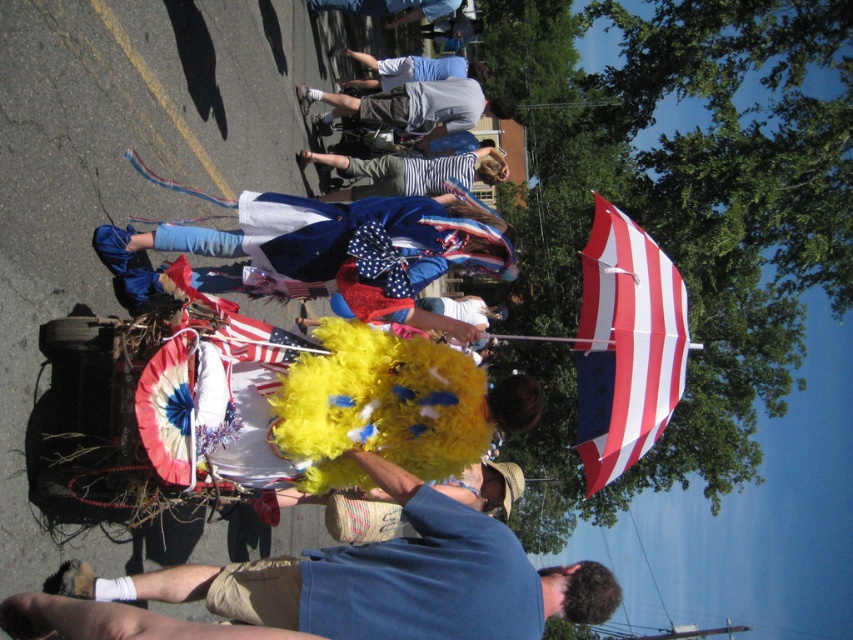
What is located at the point with coordinates (410, 172)?

The point at (410, 172) corresponds to striped fabric at center.

You are standing at the lower left corner of the image. Looking towards the upper right, you see an object at point (625, 344). What is the object located at that point?

The object at point (625, 344) is a red and white striped umbrella at upper right.

You are a photographer standing in the parade. You want to take a photo of the light blue cotton shirt at upper center without the red and white striped umbrella at upper right appearing in the frame. Is the umbrella currently blocking the view of the shirt?

The red and white striped umbrella at upper right is positioned under the light blue cotton shirt at upper center, so the umbrella is below the shirt and not blocking the view. You can take the photo without any obstruction.